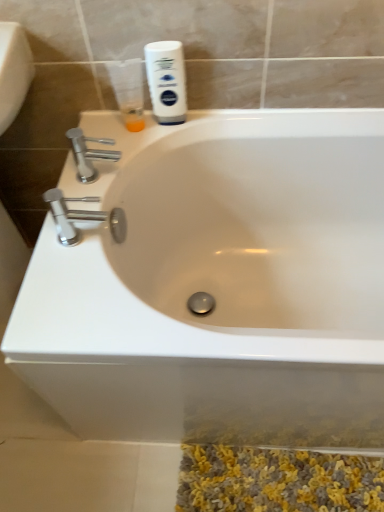
Question: Is translucent plastic cup at upper left further to camera compared to white glossy bathtub at center?

Choices:
 (A) yes
 (B) no

Answer: (A)

Question: Considering the relative positions of translucent plastic cup at upper left and white glossy bathtub at center in the image provided, is translucent plastic cup at upper left to the right of white glossy bathtub at center from the viewer's perspective?

Choices:
 (A) no
 (B) yes

Answer: (A)

Question: Can you confirm if translucent plastic cup at upper left is positioned to the left of white glossy bathtub at center?

Choices:
 (A) no
 (B) yes

Answer: (B)

Question: Is translucent plastic cup at upper left positioned in front of white glossy bathtub at center?

Choices:
 (A) no
 (B) yes

Answer: (A)

Question: From a real-world perspective, is translucent plastic cup at upper left beneath white glossy bathtub at center?

Choices:
 (A) yes
 (B) no

Answer: (B)

Question: Does translucent plastic cup at upper left have a lesser width compared to white glossy bathtub at center?

Choices:
 (A) yes
 (B) no

Answer: (A)

Question: From the image's perspective, is white matte shaving cream at upper center under chrome metallic faucet at left, the second tap when ordered from top to bottom?

Choices:
 (A) no
 (B) yes

Answer: (A)

Question: From a real-world perspective, is white matte shaving cream at upper center over chrome metallic faucet at left, marked as the first tap in a bottom-to-top arrangement?

Choices:
 (A) yes
 (B) no

Answer: (A)

Question: Are white matte shaving cream at upper center and chrome metallic faucet at left, acting as the first tap starting from the front, far apart?

Choices:
 (A) no
 (B) yes

Answer: (A)

Question: Is white matte shaving cream at upper center placed right next to chrome metallic faucet at left, the second tap when ordered from top to bottom?

Choices:
 (A) yes
 (B) no

Answer: (B)

Question: From the image's perspective, would you say white matte shaving cream at upper center is positioned over chrome metallic faucet at left, marked as the first tap in a bottom-to-top arrangement?

Choices:
 (A) yes
 (B) no

Answer: (A)

Question: Considering the relative positions of white matte shaving cream at upper center and chrome metallic faucet at left, acting as the first tap starting from the front, in the image provided, is white matte shaving cream at upper center to the right of chrome metallic faucet at left, acting as the first tap starting from the front, from the viewer's perspective?

Choices:
 (A) yes
 (B) no

Answer: (A)

Question: Are white matte shaving cream at upper center and polished chrome faucet at upper left, marked as the first tap in a back-to-front arrangement, beside each other?

Choices:
 (A) no
 (B) yes

Answer: (A)